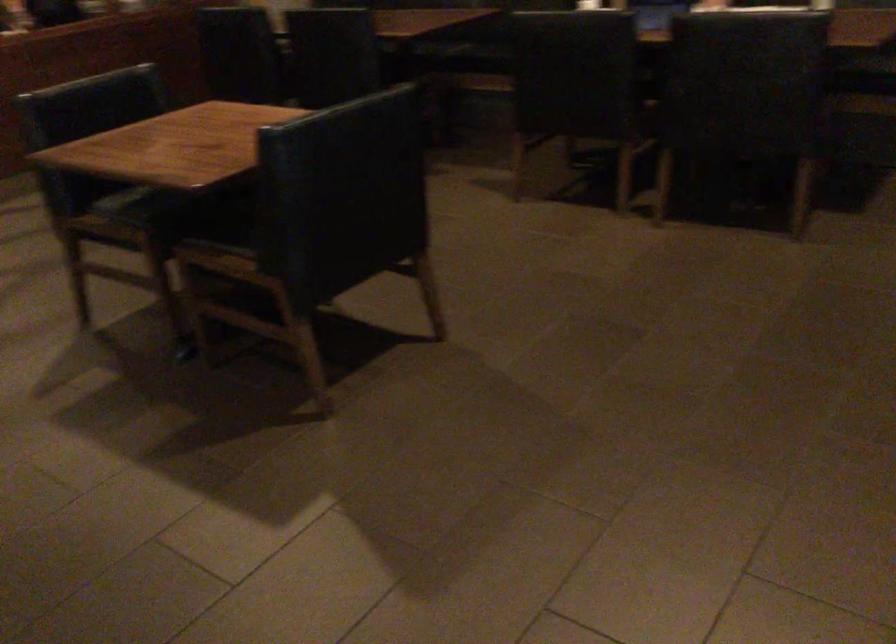
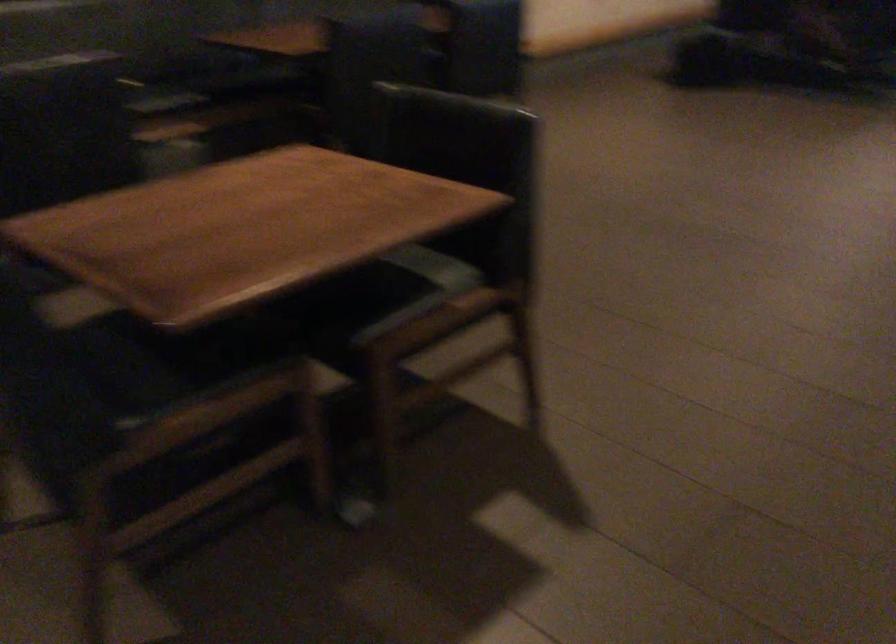
Question: The camera is either moving clockwise (left) or counter-clockwise (right) around the object. The first image is from the beginning of the video and the second image is from the end. Is the camera moving left or right when shooting the video?

Choices:
 (A) Left
 (B) Right

Answer: (A)